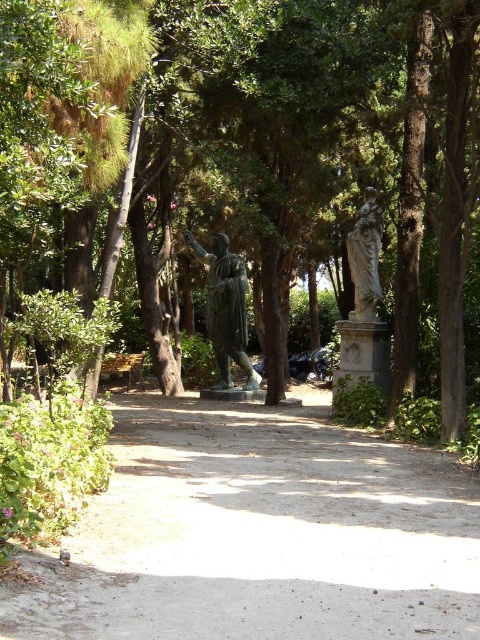
You are standing at the entrance of the park and want to take a photo of the green leafy tree at center. In which direction should you walk to get closer to the tree?

The green leafy tree at center is located at point [317,163], so you should walk towards the center of the park to get closer to it.

You are a park visitor trying to decide which statue to photograph first. The bronze statue at center and the stone statue at center are both in your view. Which one is wider?

The bronze statue at center is wider than the stone statue at center.